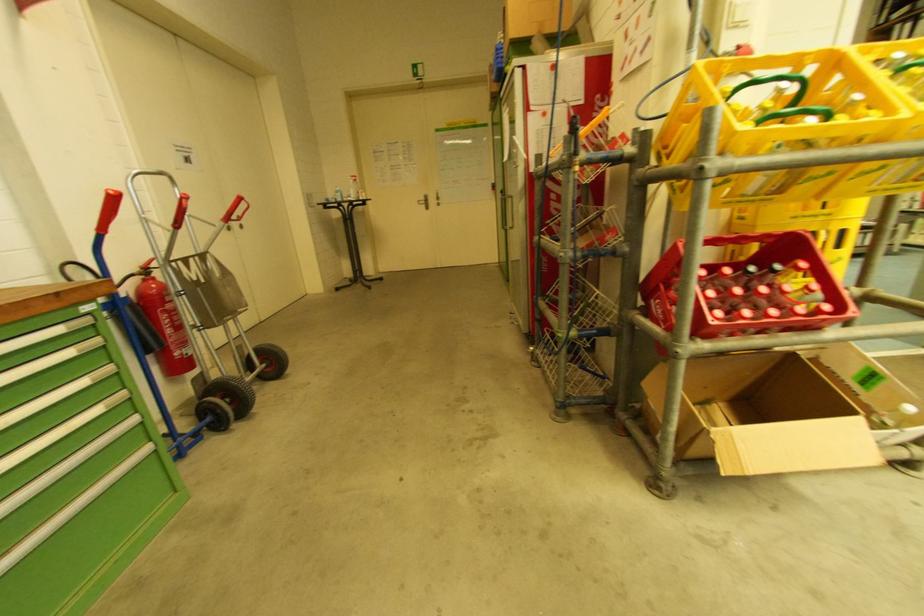
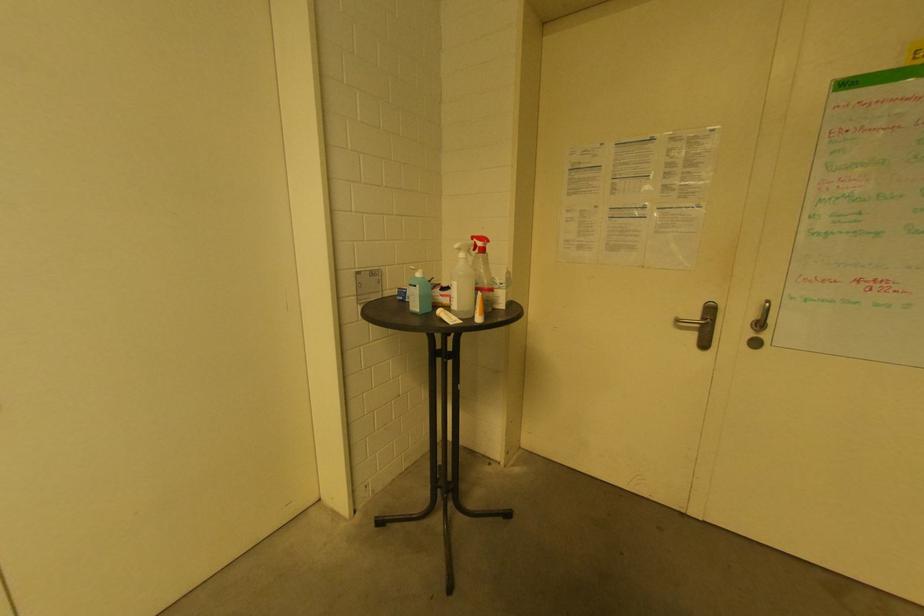
Where in the second image is the point corresponding to [354,183] from the first image?

(464, 256)